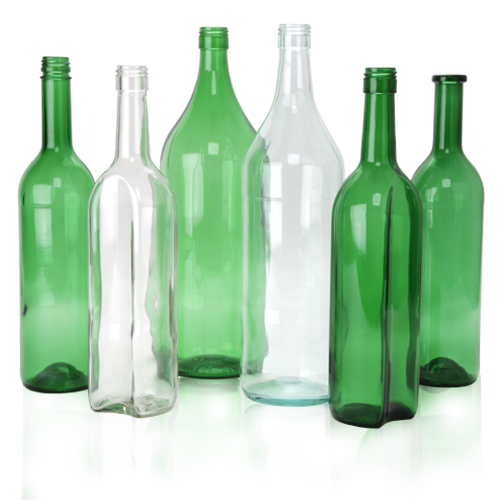
The width and height of the screenshot is (500, 500). Find the location of `bottles`. bottles is located at coordinates (55, 320), (119, 289), (208, 253), (279, 251), (351, 247), (444, 237).